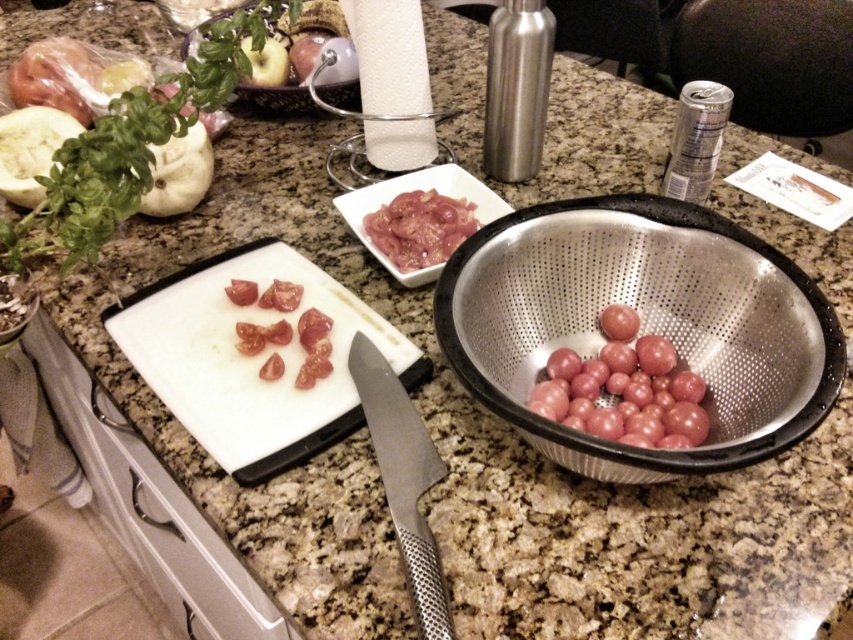
Between glossy red tomato at center right and pink glossy meat at center, which one appears on the left side from the viewer's perspective?

Positioned to the left is pink glossy meat at center.

Who is positioned more to the right, glossy red tomato at center right or pink glossy meat at center?

glossy red tomato at center right is more to the right.

This screenshot has height=640, width=853. What do you see at coordinates (624, 388) in the screenshot? I see `glossy red tomato at center right` at bounding box center [624, 388].

Where is `glossy red tomato at center right`? This screenshot has width=853, height=640. glossy red tomato at center right is located at coordinates (624, 388).

From the picture: Does pink glossy meat at center have a greater width compared to green matte squash at upper left?

Indeed, pink glossy meat at center has a greater width compared to green matte squash at upper left.

From the picture: Is pink glossy meat at center closer to camera compared to green matte squash at upper left?

No, it is not.

Identify the location of pink glossy meat at center. This screenshot has width=853, height=640. (419, 228).

I want to click on pink glossy meat at center, so click(x=419, y=228).

Is the position of green leafy vegetable at upper left less distant than that of green leafy basil at upper left?

Yes.

The image size is (853, 640). I want to click on green leafy vegetable at upper left, so click(129, 148).

Is point (190, 100) in front of point (22, 125)?

Yes.

Where is `green leafy vegetable at upper left`? The image size is (853, 640). green leafy vegetable at upper left is located at coordinates (129, 148).